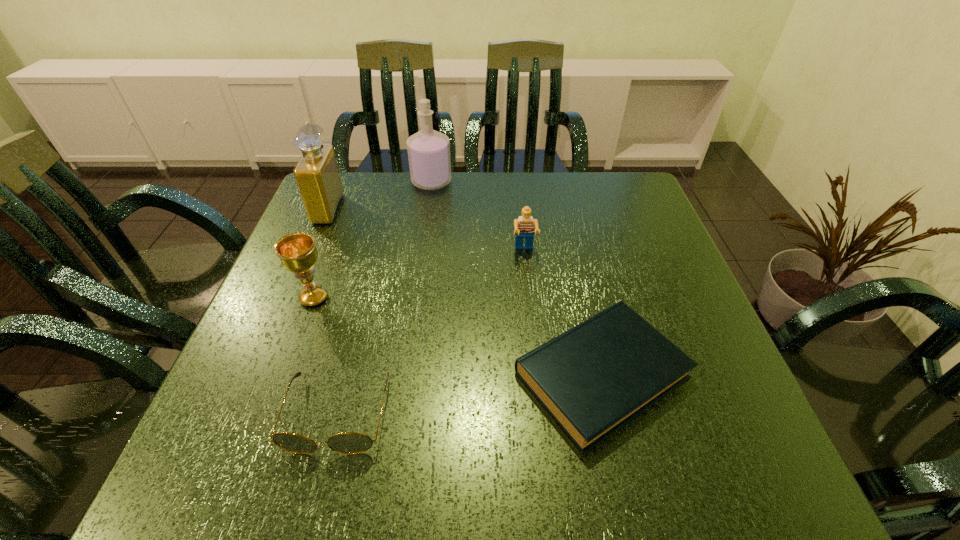
Image resolution: width=960 pixels, height=540 pixels. Identify the location of free space between the fifth tallest object and the chalice. (325, 356).

The image size is (960, 540). I want to click on object that is the second closest to the shortest object, so click(x=348, y=442).

Select which object is the fifth closest to the third farthest object. Please provide its 2D coordinates. Your answer should be formatted as a tuple, i.e. [(x, y)], where the tuple contains the x and y coordinates of a point satisfying the conditions above.

[(317, 175)]

You are a GUI agent. You are given a task and a screenshot of the screen. Output one action in this format:
    pyautogui.click(x=<x>, y=<y>)
    Task: Click on the free space that satisfies the following two spatial constraints: 1. on the front-facing side of the left perfume; 2. on the left side of the shortest object
    The height and width of the screenshot is (540, 960).
    Given the screenshot: What is the action you would take?
    pyautogui.click(x=258, y=375)

Locate an element on the screen. This screenshot has width=960, height=540. blank space that satisfies the following two spatial constraints: 1. on the face of the fourth tallest object; 2. on the left side of the shortest object is located at coordinates (538, 375).

In order to click on vacant area in the image that satisfies the following two spatial constraints: 1. on the front side of the book; 2. on the left side of the chalice in this screenshot , I will do `click(285, 375)`.

The width and height of the screenshot is (960, 540). I want to click on blank area in the image that satisfies the following two spatial constraints: 1. on the face of the book; 2. on the right side of the third shortest object, so click(x=538, y=375).